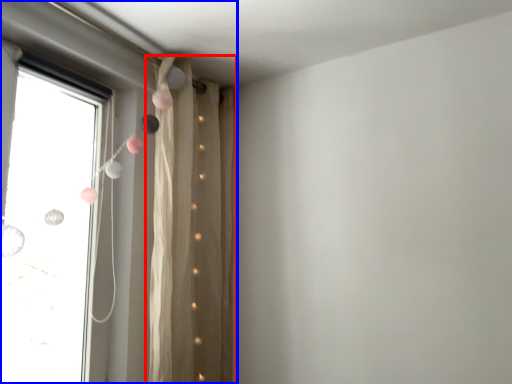
Question: Which object appears farthest to the camera in this image, curtain (highlighted by a red box) or window (highlighted by a blue box)?

Choices:
 (A) curtain
 (B) window

Answer: (A)